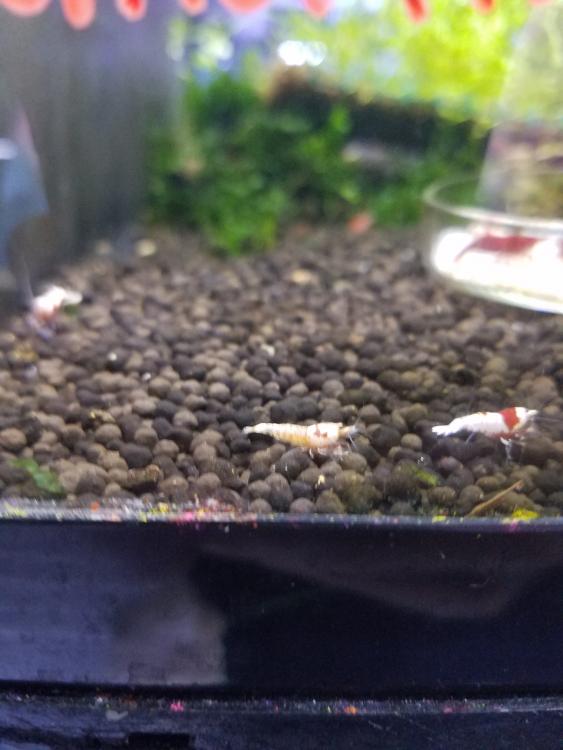
Identify the location of bottom of bowl. (510, 284).